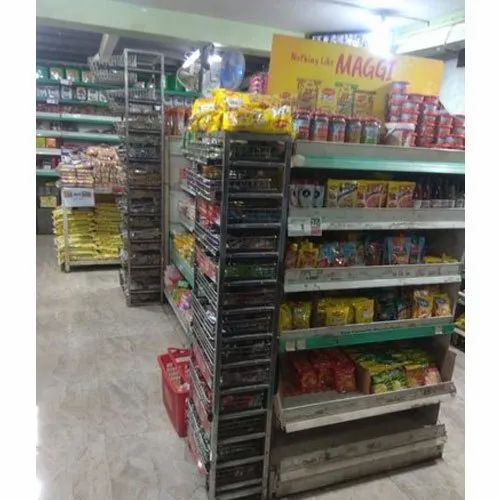
Find the location of a particular element. The height and width of the screenshot is (500, 500). ceiling is located at coordinates (267, 5).